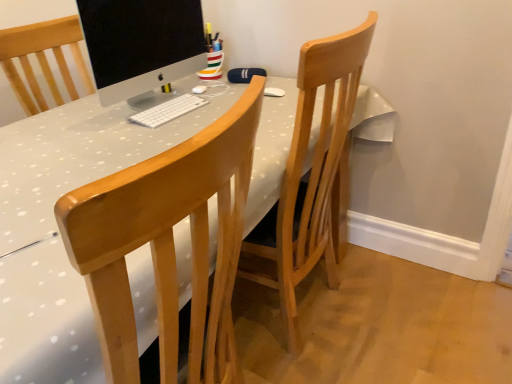
Locate an element on the screen. vacant point to the right of sleek silver monitor at center is located at coordinates (232, 98).